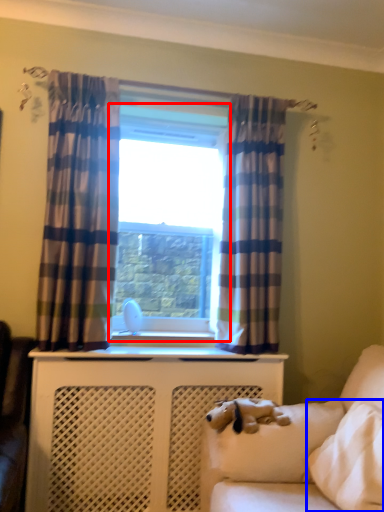
Question: Which point is closer to the camera, window (highlighted by a red box) or pillow (highlighted by a blue box)?

Choices:
 (A) window
 (B) pillow

Answer: (B)